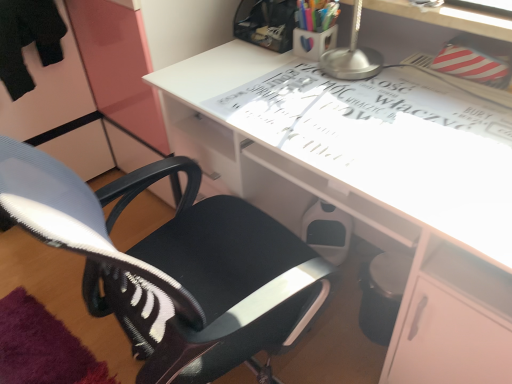
I want to click on free spot above white glossy desk at center (from a real-world perspective), so click(x=341, y=115).